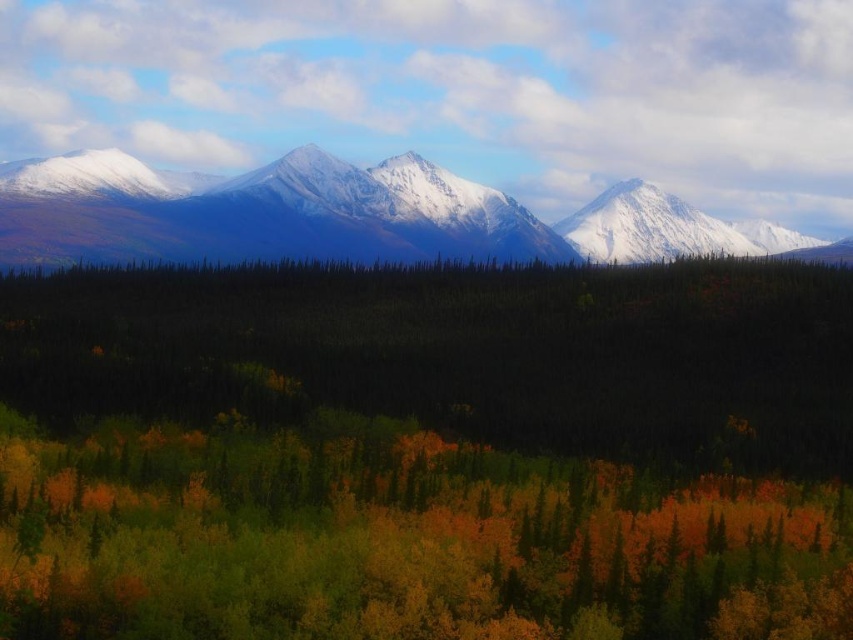
What do you see at coordinates (427, 452) in the screenshot?
I see `green matte forest at center` at bounding box center [427, 452].

Which is in front, point (672, 436) or point (62, 198)?

Positioned in front is point (672, 436).

You are a GUI agent. You are given a task and a screenshot of the screen. Output one action in this format:
    pyautogui.click(x=<x>, y=<y>)
    Task: Click on the green matte forest at center
    The width and height of the screenshot is (853, 640).
    Given the screenshot: What is the action you would take?
    pyautogui.click(x=427, y=452)